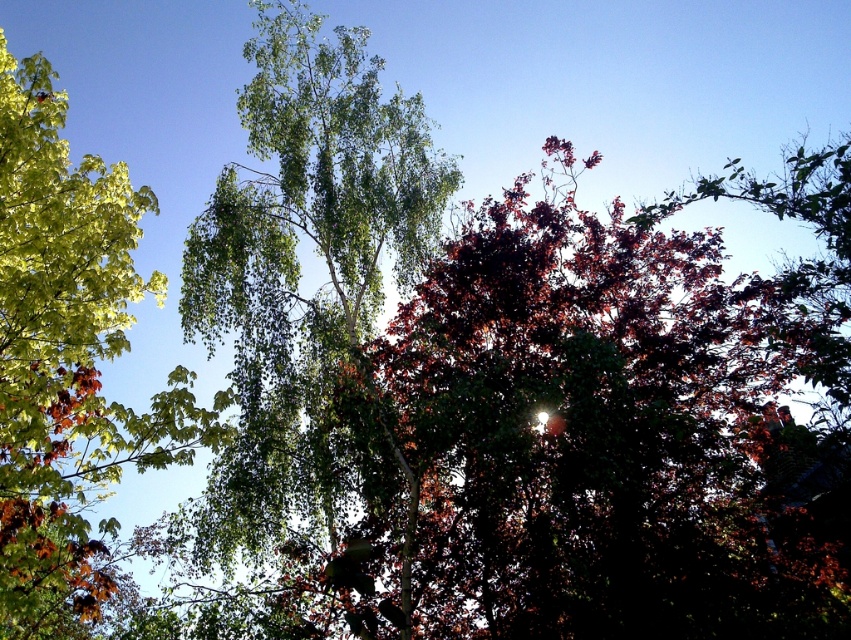
Question: Which of the following is the farthest from the observer?

Choices:
 (A) (323, 218)
 (B) (6, 248)

Answer: (A)

Question: Does green leafy birch tree at center appear under green leafy tree at left?

Choices:
 (A) yes
 (B) no

Answer: (B)

Question: Which of the following is the closest to the observer?

Choices:
 (A) green leafy tree at left
 (B) green leafy birch tree at center

Answer: (A)

Question: Does green leafy birch tree at center lie in front of green leafy tree at left?

Choices:
 (A) yes
 (B) no

Answer: (B)

Question: Where is green leafy birch tree at center located in relation to green leafy tree at left in the image?

Choices:
 (A) left
 (B) right

Answer: (B)